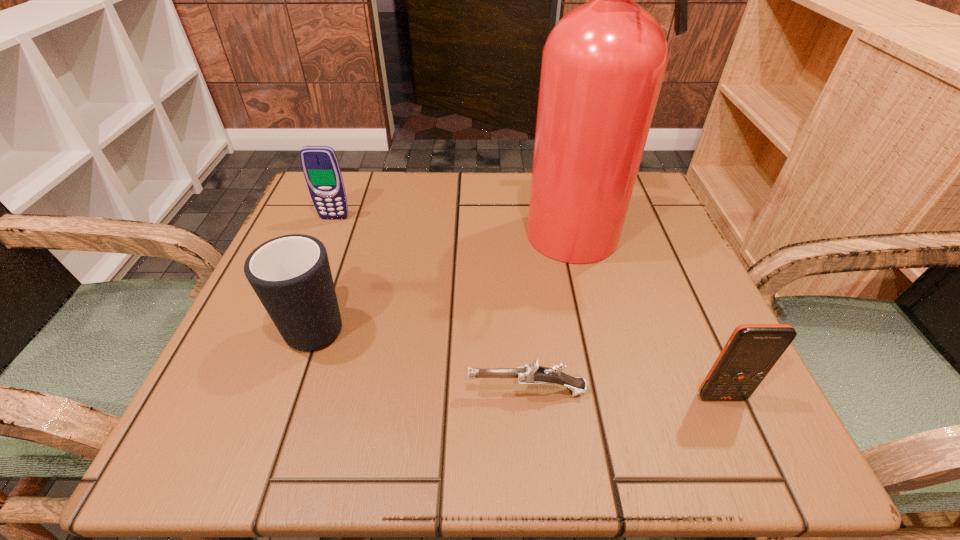
Identify the location of object that is the third closest to the right cellular telephone. This screenshot has height=540, width=960. (290, 274).

What are the coordinates of `the second closest object to the mug` in the screenshot? It's located at (531, 374).

The image size is (960, 540). I want to click on vacant space that satisfies the following two spatial constraints: 1. on the side of the mug with the handle; 2. on the right side of the fire extinguisher, so click(348, 235).